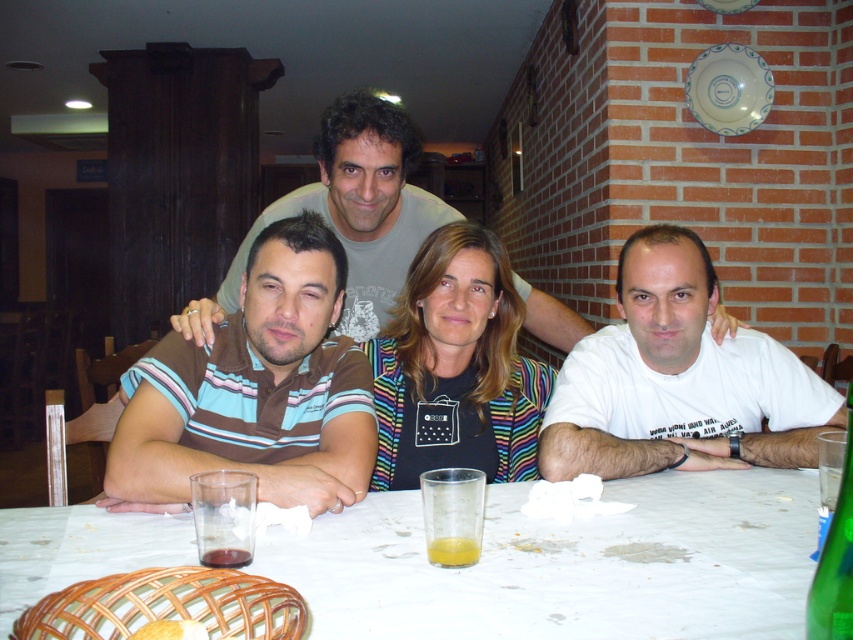
Does white cotton shirt at right have a lesser width compared to translucent glass at table center?

No.

Who is shorter, white cotton shirt at right or translucent glass at table center?

translucent glass at table center is shorter.

Looking at this image, who is more forward, (792, 369) or (239, 561)?

Point (239, 561) is in front.

Locate an element on the screen. The width and height of the screenshot is (853, 640). white cotton shirt at right is located at coordinates (677, 380).

Does matte gray t-shirt at center have a greater width compared to yellow translucent liquid at table center?

Correct, the width of matte gray t-shirt at center exceeds that of yellow translucent liquid at table center.

Measure the distance between matte gray t-shirt at center and camera.

matte gray t-shirt at center and camera are 4.81 feet apart from each other.

Who is more distant from viewer, (370, 227) or (447, 552)?

The point (370, 227) is behind.

Locate an element on the screen. This screenshot has width=853, height=640. matte gray t-shirt at center is located at coordinates (347, 212).

Does white paper table at center have a greater height compared to yellow translucent glass at table center?

No, white paper table at center is not taller than yellow translucent glass at table center.

Which is behind, point (454, 588) or point (451, 509)?

Point (451, 509)

Locate an element on the screen. white paper table at center is located at coordinates (567, 563).